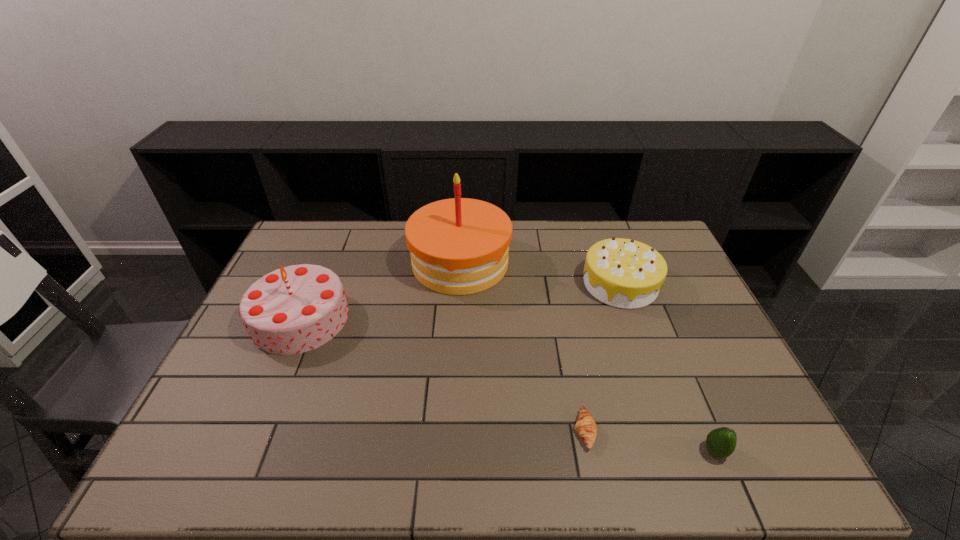
The width and height of the screenshot is (960, 540). Identify the location of vacant space positioned 0.120m on the right of the leftmost birthday cake. (389, 318).

Image resolution: width=960 pixels, height=540 pixels. What are the coordinates of `free spot located on the left of the third tallest object` in the screenshot? It's located at (537, 284).

The height and width of the screenshot is (540, 960). Find the location of `vacant space located 0.060m on the left of the second shortest object`. vacant space located 0.060m on the left of the second shortest object is located at coordinates (676, 451).

You are a GUI agent. You are given a task and a screenshot of the screen. Output one action in this format:
    pyautogui.click(x=<x>, y=<y>)
    Task: Click on the free space located on the front-facing side of the third object from left to right
    This screenshot has height=540, width=960.
    Given the screenshot: What is the action you would take?
    pyautogui.click(x=443, y=431)

The image size is (960, 540). Find the location of `vacant area situated 0.350m on the front-facing side of the third object from left to right`. vacant area situated 0.350m on the front-facing side of the third object from left to right is located at coordinates (425, 431).

What are the coordinates of `free space located on the front-facing side of the third object from left to right` in the screenshot? It's located at (451, 431).

This screenshot has height=540, width=960. I want to click on avocado that is at the near edge, so click(721, 442).

Locate an element on the screen. pastry at the near edge is located at coordinates (585, 425).

Find the location of a particular element. The image size is (960, 540). object present at the left edge is located at coordinates (295, 309).

Locate an element on the screen. birthday cake that is positioned at the right edge is located at coordinates (623, 273).